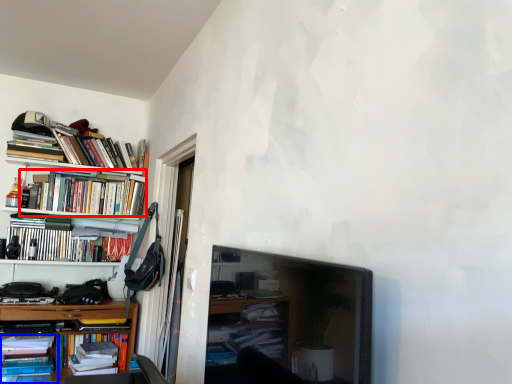
Question: Which object is further to the camera taking this photo, book (highlighted by a red box) or book (highlighted by a blue box)?

Choices:
 (A) book
 (B) book

Answer: (A)